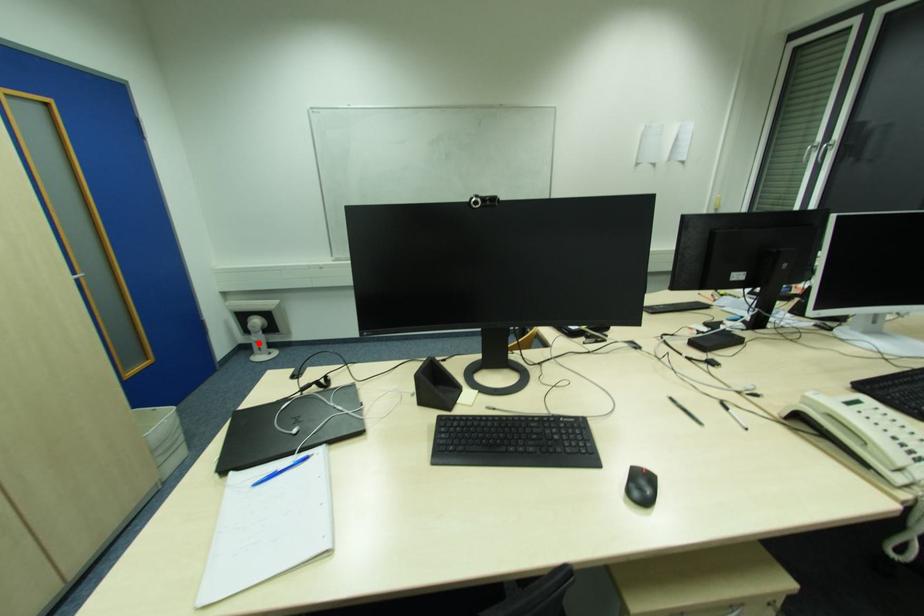
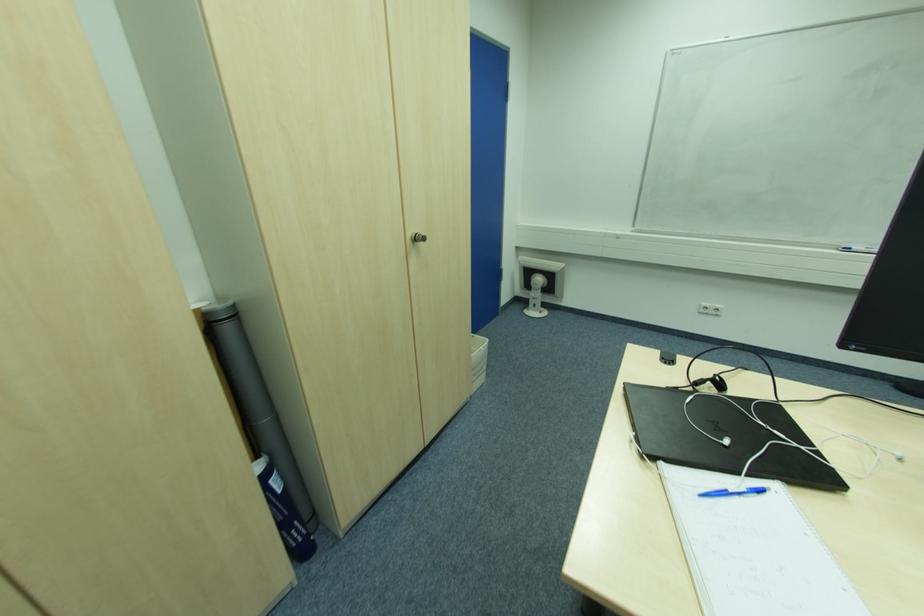
Locate, in the second image, the point that corresponds to the highlighted location in the first image.

(536, 300)